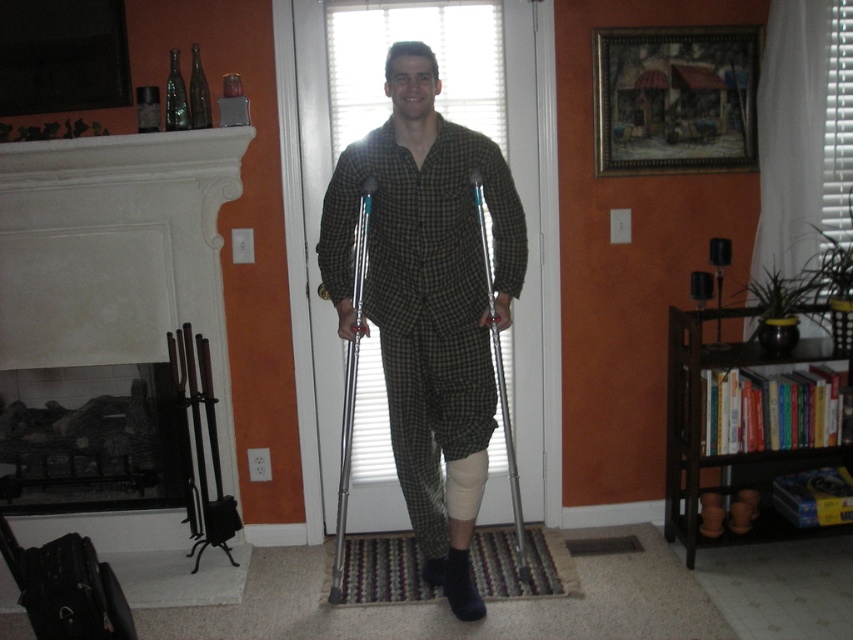
You are a physical therapist observing the person with the metallic silver crutch at center and the silver metallic crutch at center. Which crutch is narrower in width?

The metallic silver crutch at center is narrower in width than the silver metallic crutch at center.

You are a physical therapist visiting a patient in their living room. You notice the matte green pajamas at center and the metallic silver crutch at center. Which object is taller?

The matte green pajamas at center is taller than the metallic silver crutch at center.

You are a physical therapist visiting a patient in their living room. You need to check the position of the patient wearing the matte green pajamas at center and the metallic silver crutch at center. Is the patient closer to you than the crutch?

The matte green pajamas at center is in front of the metallic silver crutch at center, so yes, the patient wearing the matte green pajamas at center is closer to you than the metallic silver crutch at center.